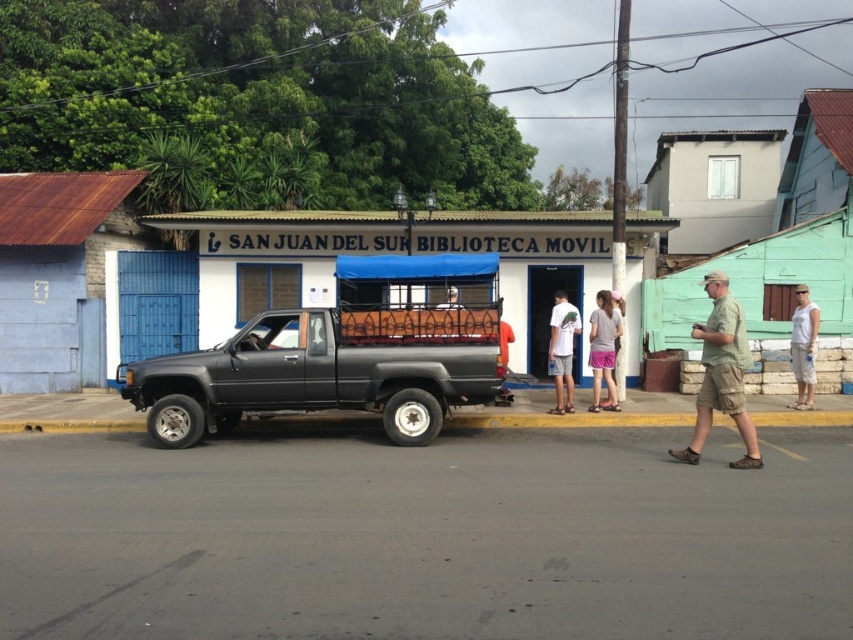
You are a delivery person who needs to load a large package into the black matte truck at center. You notice a green camo shirt at center nearby. Can you fit both the package and the shirt into the truck bed without overlapping?

The black matte truck at center is bigger than the green camo shirt at center, so yes, both the package and the shirt can fit into the truck bed without overlapping.

You are a customer at the SAN JUAN DEL SUR BIBLIOTECA MOVIL. You see a person wearing a green camo shirt at center and a pink fabric skirt at center. Which clothing item is higher on their body?

The green camo shirt at center is taller than the pink fabric skirt at center, so the green camo shirt at center is higher on their body.

You are a delivery person trying to park your van behind the white matte truck at center. The pink fabric skirt at center is blocking the path. Can you drive around the truck to get past the skirt?

The white matte truck at center is positioned over the pink fabric skirt at center, so driving around the truck would allow you to bypass the skirt.